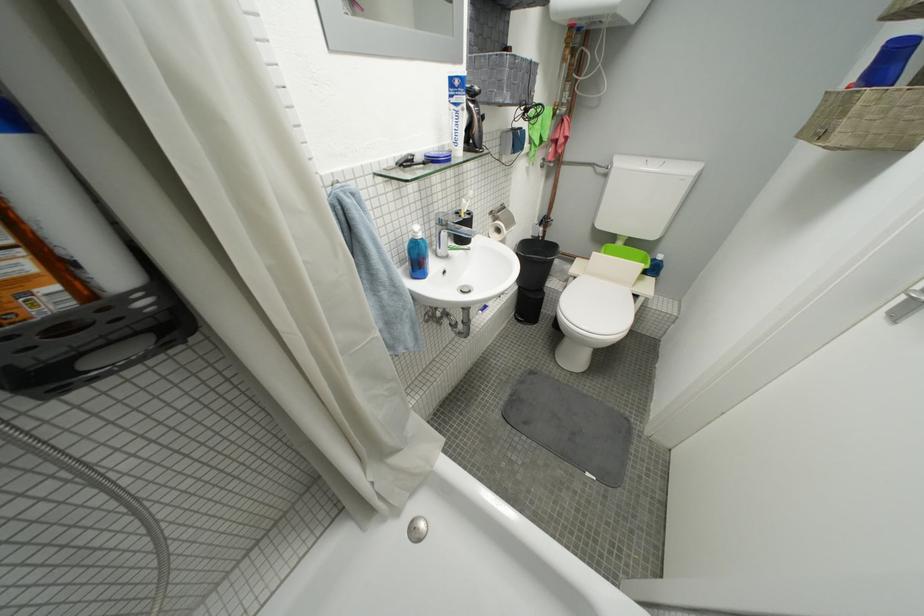
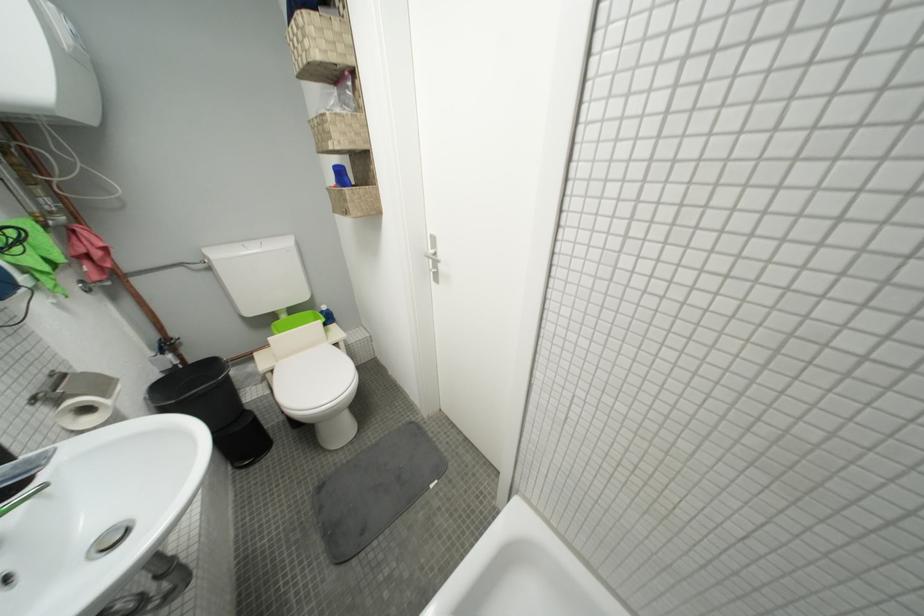
Question: How did the camera likely rotate?

Choices:
 (A) Left
 (B) Right
 (C) Up
 (D) Down

Answer: (B)